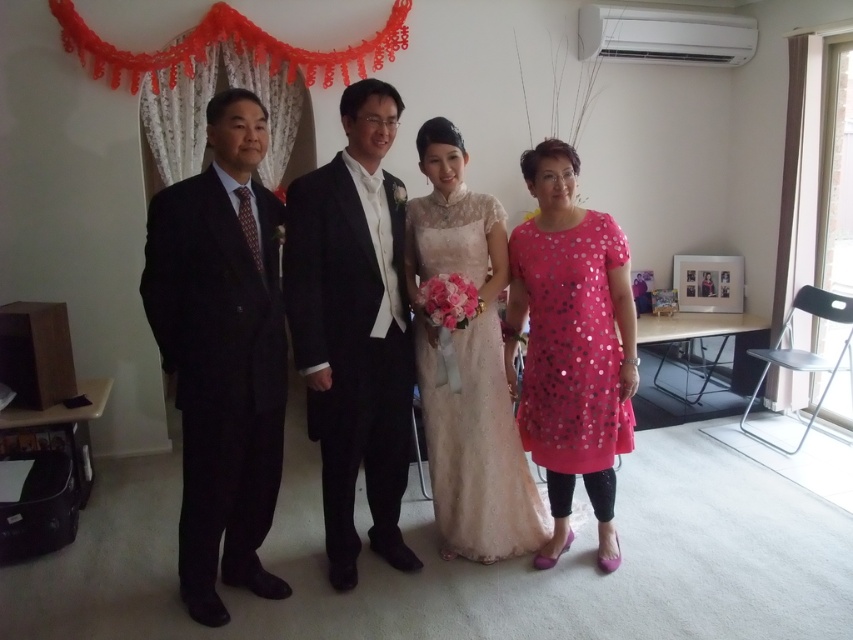
Which is behind, point (561, 141) or point (486, 358)?

Point (561, 141)

Does point (508, 358) come closer to viewer compared to point (502, 554)?

Yes.

This screenshot has width=853, height=640. I want to click on pink sequined dress at right, so click(x=572, y=346).

This screenshot has height=640, width=853. What do you see at coordinates (222, 353) in the screenshot?
I see `dark suit at left` at bounding box center [222, 353].

Where is `dark suit at left`? dark suit at left is located at coordinates (222, 353).

Which of these two, dark suit at left or satin lace dress at center, stands shorter?

Standing shorter between the two is satin lace dress at center.

Is the position of dark suit at left more distant than that of satin lace dress at center?

No, dark suit at left is closer to the viewer.

Find the location of a particular element. This screenshot has height=640, width=853. dark suit at left is located at coordinates (222, 353).